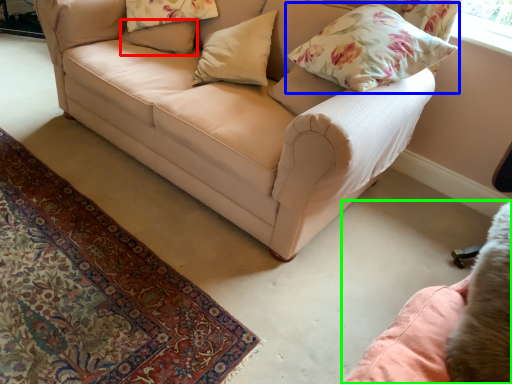
Question: Which object is positioned closest to pillow (highlighted by a red box)? Select from pillow (highlighted by a blue box) and swivel chair (highlighted by a green box).

Choices:
 (A) pillow
 (B) swivel chair

Answer: (A)